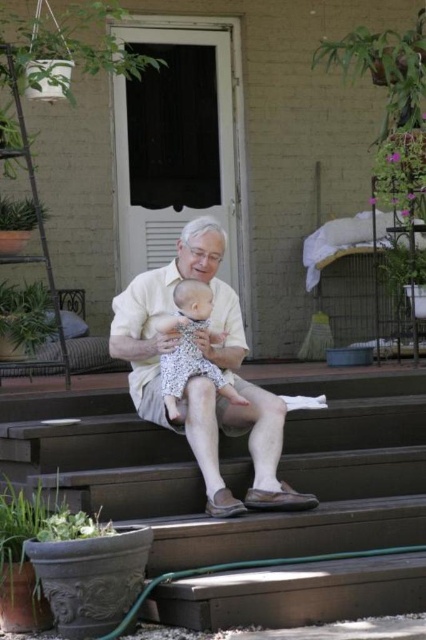
You are a photographer standing in front of the scene. You want to take a photo of the white lace dress at center and the brown wooden stairs at center. Which object should you focus on first if you want to capture both in the same frame without moving the camera?

The brown wooden stairs at center is below the white lace dress at center, so you should focus on the white lace dress at center first to ensure both are in focus since it is farther away.

You are a photographer trying to capture the scene of the elderly man and the baby. You need to ensure that both the brown wooden stairs at center and the light beige cotton shirt at center are clearly visible in the photo. Given their size difference, which object should you focus on to ensure both are in frame without cropping?

The brown wooden stairs at center is larger in size than the light beige cotton shirt at center. To ensure both are in frame without cropping, focus on the larger brown wooden stairs at center as it occupies more space, allowing the smaller light beige cotton shirt at center to naturally fit into the composition.